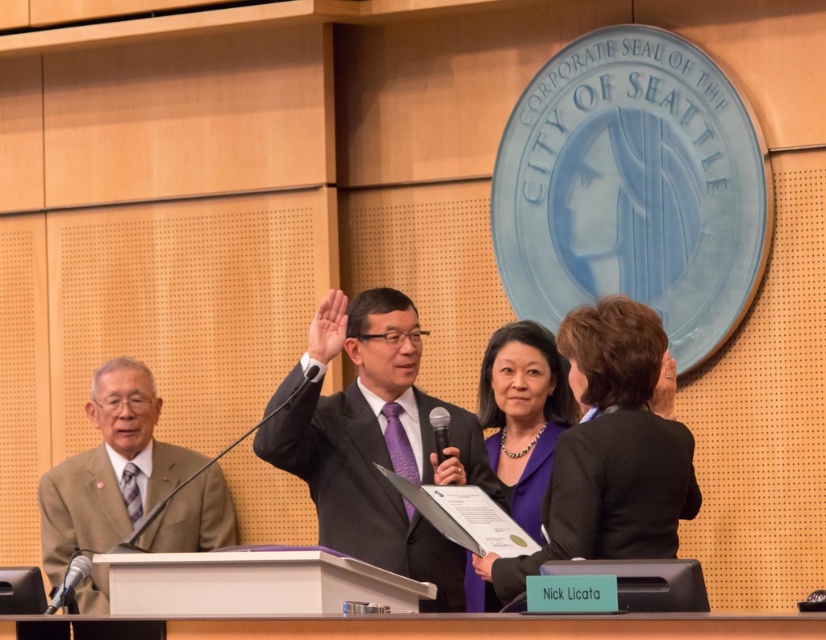
Question: Which point appears closest to the camera in this image?

Choices:
 (A) (453, 456)
 (B) (435, 448)
 (C) (606, 490)
 (D) (95, 374)

Answer: (C)

Question: Can you confirm if matte black suit at center is positioned above tan textured suit at left?

Choices:
 (A) yes
 (B) no

Answer: (A)

Question: Considering the relative positions of purple fabric at center and black plastic microphone at center in the image provided, where is purple fabric at center located with respect to black plastic microphone at center?

Choices:
 (A) right
 (B) left

Answer: (A)

Question: Which point is farther to the camera?

Choices:
 (A) matte black microphone at center
 (B) purple fabric at center
 (C) black metallic microphone at lower left

Answer: (B)

Question: Which object appears farthest from the camera in this image?

Choices:
 (A) black plastic microphone at center
 (B) matte black microphone at center
 (C) black matte business suit at center
 (D) matte black suit at center

Answer: (A)

Question: Is matte black suit at center to the left of black plastic microphone at center from the viewer's perspective?

Choices:
 (A) no
 (B) yes

Answer: (B)